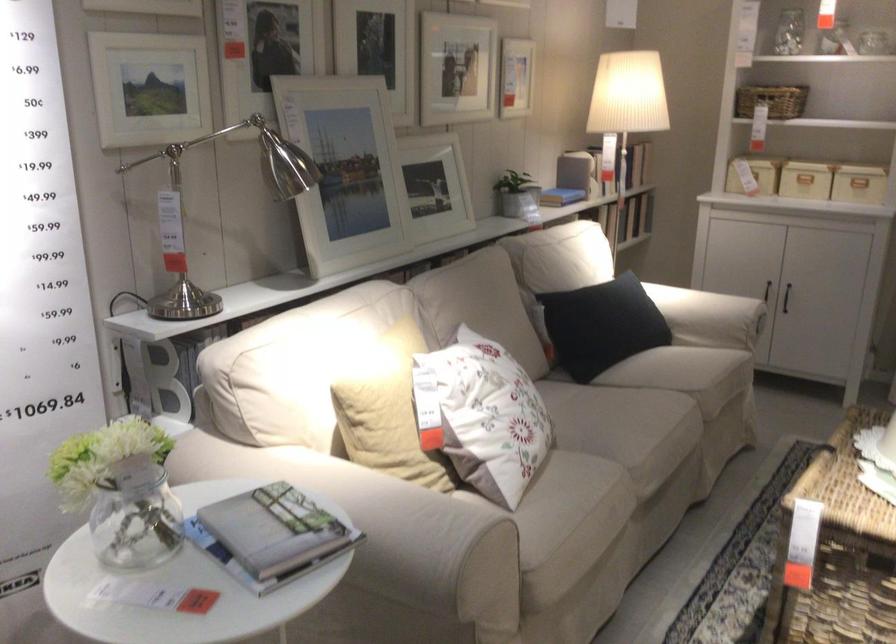
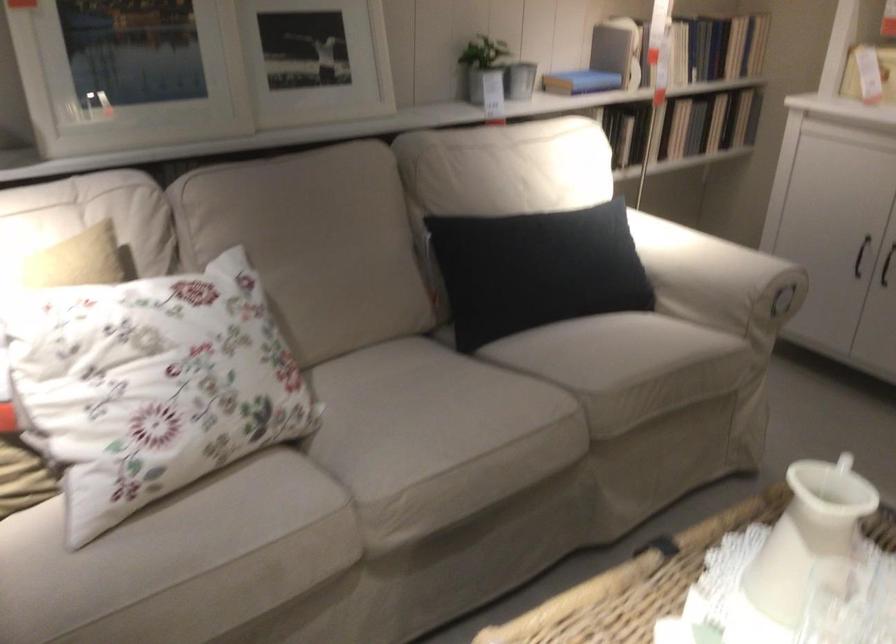
Where in the second image is the point corresponding to point 648,460 from the first image?

(398, 494)